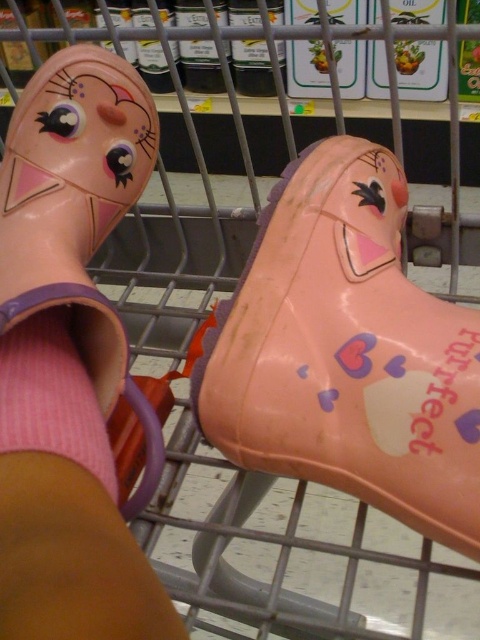
Looking at this image, which is below, pink rubber boot at center or matte pink rubber boot at upper left?

Positioned lower is pink rubber boot at center.

In the scene shown: Does pink rubber boot at center have a lesser width compared to matte pink rubber boot at upper left?

No.

Is point (303, 237) behind point (141, 120)?

No, it is not.

Identify the location of pink rubber boot at center. This screenshot has width=480, height=640. (347, 353).

Who is positioned more to the left, matte pink rubber boot at upper left or pink knitted sock at lower left?

Positioned to the left is matte pink rubber boot at upper left.

Which is more to the right, matte pink rubber boot at upper left or pink knitted sock at lower left?

pink knitted sock at lower left is more to the right.

Locate an element on the screen. The width and height of the screenshot is (480, 640). matte pink rubber boot at upper left is located at coordinates (87, 125).

The width and height of the screenshot is (480, 640). Find the location of `matte pink rubber boot at upper left`. matte pink rubber boot at upper left is located at coordinates (87, 125).

What do you see at coordinates (71, 356) in the screenshot?
I see `rubber boot at lower left` at bounding box center [71, 356].

Is rubber boot at lower left wider than matte pink rubber boot at upper left?

Yes.

Which is in front, point (71, 461) or point (14, 132)?

Point (71, 461)

This screenshot has width=480, height=640. I want to click on rubber boot at lower left, so click(x=71, y=356).